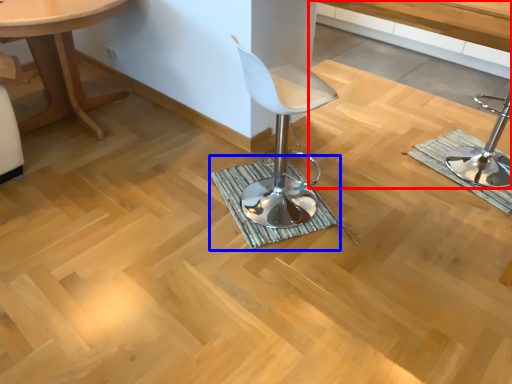
Question: Among these objects, which one is farthest to the camera, vanity (highlighted by a red box) or bath mat (highlighted by a blue box)?

Choices:
 (A) vanity
 (B) bath mat

Answer: (B)